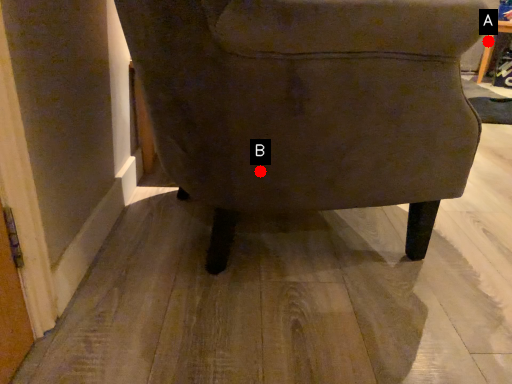
Question: Two points are circled on the image, labeled by A and B beside each circle. Which point is farther from the camera taking this photo?

Choices:
 (A) A is further
 (B) B is further

Answer: (A)